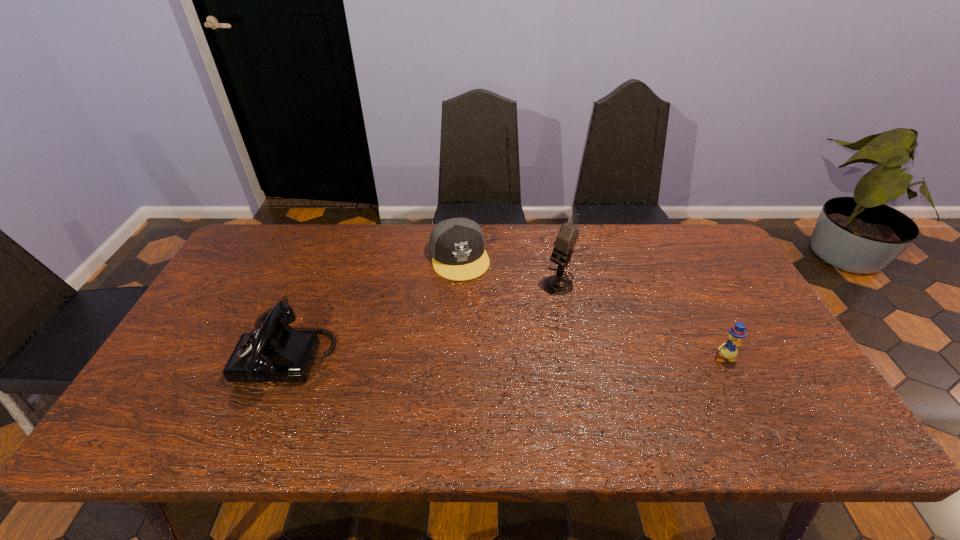
The image size is (960, 540). Identify the location of free space located on the front-facing side of the second object from right to left. (458, 364).

The image size is (960, 540). Find the location of `vacant position located 0.190m on the front-facing side of the second object from right to left`. vacant position located 0.190m on the front-facing side of the second object from right to left is located at coordinates (506, 326).

Find the location of a particular element. The image size is (960, 540). vacant space situated 0.230m on the front-facing side of the cap is located at coordinates (484, 338).

Identify the location of blank area located on the front-facing side of the cap. Image resolution: width=960 pixels, height=540 pixels. (500, 387).

At what (x,y) coordinates should I click in order to perform the action: click on vacant area located 0.300m on the front-facing side of the cap. Please return your answer as a coordinate pair (x, y). The height and width of the screenshot is (540, 960). Looking at the image, I should click on tap(491, 358).

The width and height of the screenshot is (960, 540). Find the location of `microphone located at the far edge`. microphone located at the far edge is located at coordinates (558, 285).

You are a GUI agent. You are given a task and a screenshot of the screen. Output one action in this format:
    pyautogui.click(x=<x>, y=<y>)
    Task: Click on the cap positioned at the far edge
    
    Given the screenshot: What is the action you would take?
    pyautogui.click(x=457, y=246)

The image size is (960, 540). In order to click on object located in the near edge section of the desktop in this screenshot , I will do `click(275, 352)`.

I want to click on object that is at the right edge, so click(728, 350).

Image resolution: width=960 pixels, height=540 pixels. Identify the location of free spot at the far edge of the desktop. (404, 253).